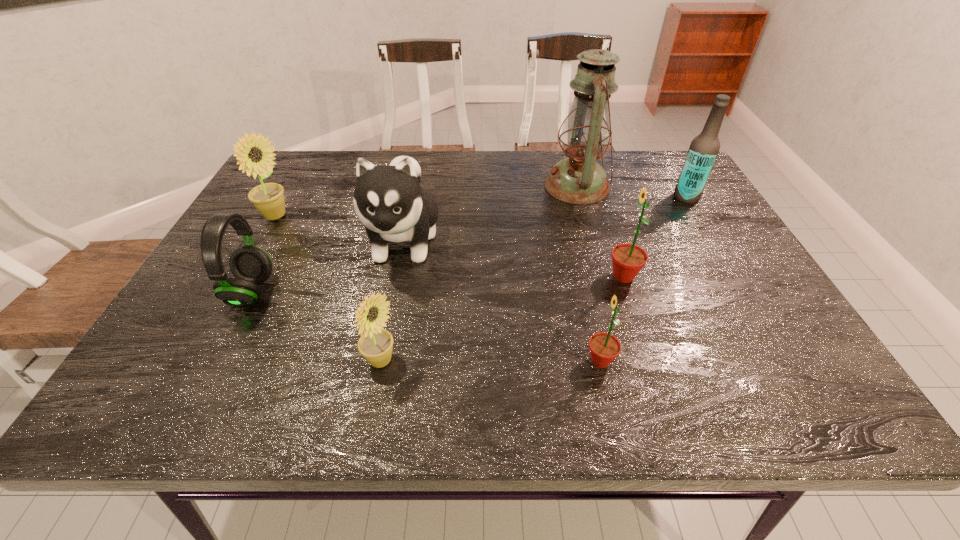
Where is `the tallest object`? the tallest object is located at coordinates (579, 179).

At what (x,y) coordinates should I click in order to perform the action: click on the rightmost object. Please return your answer as a coordinate pair (x, y). Image resolution: width=960 pixels, height=540 pixels. Looking at the image, I should click on (704, 148).

The width and height of the screenshot is (960, 540). Identify the location of puppy. click(388, 200).

The image size is (960, 540). What are the coordinates of `the leftmost sunflower` in the screenshot? It's located at (268, 198).

The height and width of the screenshot is (540, 960). In order to click on the farther yellow sunflower in this screenshot , I will do `click(268, 198)`.

At what (x,y) coordinates should I click in order to perform the action: click on the farther green sunflower. Please return your answer as a coordinate pair (x, y). This screenshot has height=540, width=960. Looking at the image, I should click on (628, 259).

Find the location of `the second farthest sunflower`. the second farthest sunflower is located at coordinates (628, 259).

What are the coordinates of `black headset` in the screenshot? It's located at 251,266.

I want to click on the nearer yellow sunflower, so (376, 344).

At what (x,y) coordinates should I click in order to perform the action: click on the smaller yellow sunflower. Please return your answer as a coordinate pair (x, y). This screenshot has width=960, height=540. Looking at the image, I should click on (376, 344).